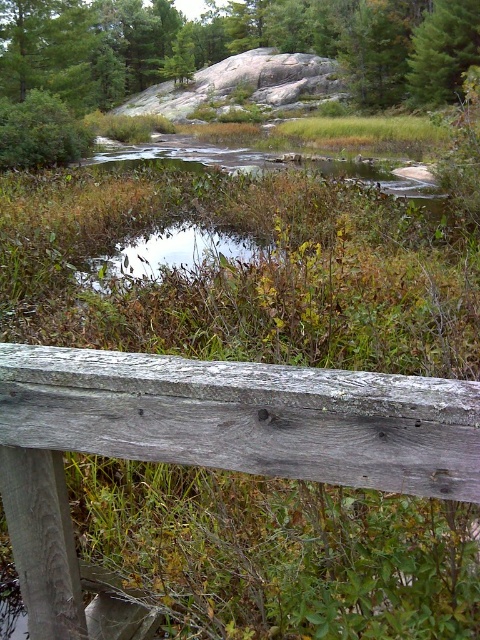
The height and width of the screenshot is (640, 480). What do you see at coordinates (170, 253) in the screenshot?
I see `green grassy puddle at center` at bounding box center [170, 253].

Who is more forward, (180, 250) or (477, 17)?

Point (180, 250) is more forward.

Does point (241, 237) lie behind point (468, 4)?

No, (241, 237) is in front of (468, 4).

Where is `green grassy puddle at center`? green grassy puddle at center is located at coordinates (170, 253).

Can you confirm if green textured rock at upper center is positioned below green matte tree at upper right?

Incorrect, green textured rock at upper center is not positioned below green matte tree at upper right.

From the picture: Who is more distant from viewer, (335, 17) or (442, 33)?

Point (335, 17)

Locate an element on the screen. The height and width of the screenshot is (640, 480). green textured rock at upper center is located at coordinates (235, 44).

I want to click on green textured rock at upper center, so click(235, 44).

Is point (415, 92) less distant than point (103, 257)?

No, it is behind (103, 257).

Where is `green textured rock at upper center`? This screenshot has width=480, height=640. green textured rock at upper center is located at coordinates (235, 44).

Which is in front, point (428, 99) or point (228, 236)?

Point (228, 236) is more forward.

At what (x,y) coordinates should I click in order to perform the action: click on green textured rock at upper center. Please return your answer as a coordinate pair (x, y). Looking at the image, I should click on pyautogui.click(x=235, y=44).